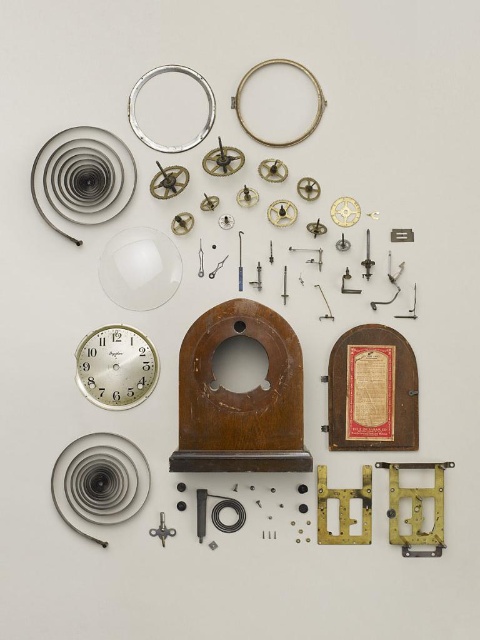
You are holding a small tool that requires precise placement at a specific point in the clock assembly. The point is located at coordinates point (317, 106). If you are standing 3 meters away from the clock parts, can you reach the point without moving closer?

The distance between point (317, 106) and the camera is 2.49 meters. Since you are standing 3 meters away, you are farther than the required distance. Therefore, you can reach the point without moving closer.